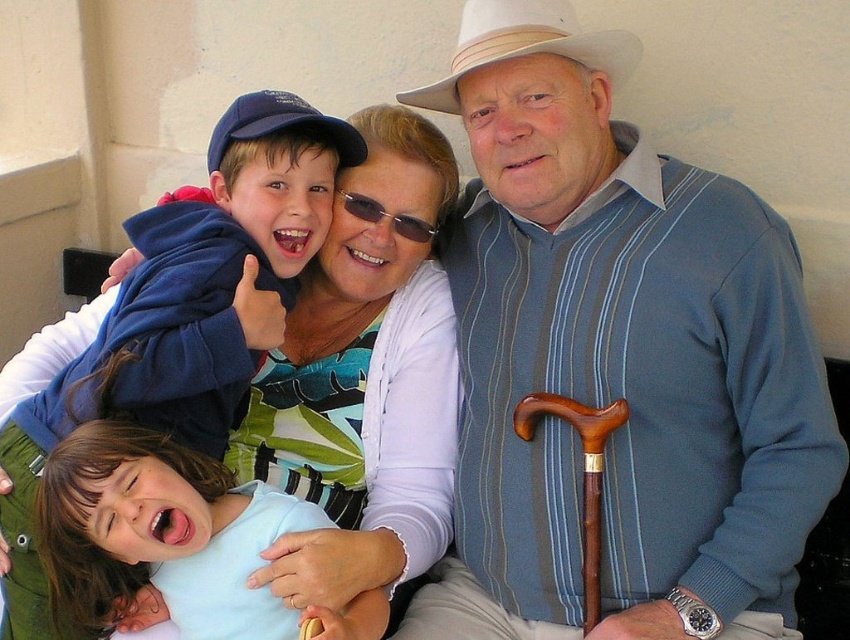
You are a fashion designer analyzing the image. Which clothing item, the blue striped sweater at center or the blue fleece jacket at upper left, has a greater height in the image?

The blue striped sweater at center is taller than the blue fleece jacket at upper left.

Where is the light blue shirt at lower left located?

The light blue shirt at lower left is located at point 0.803 on the x axis and 0.147 on the y axis.